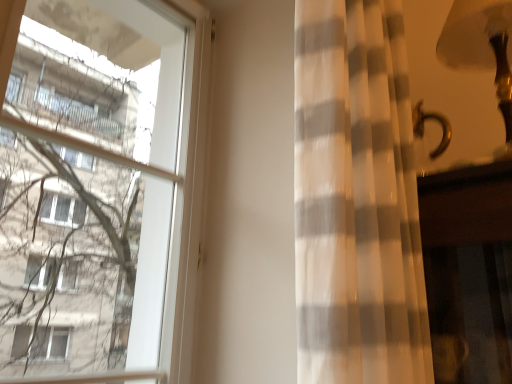
What is the approximate width of white sheer curtain at right?

13.46 inches.

This screenshot has height=384, width=512. Describe the element at coordinates (356, 199) in the screenshot. I see `white sheer curtain at right` at that location.

In order to click on white sheer curtain at right in this screenshot , I will do click(356, 199).

Image resolution: width=512 pixels, height=384 pixels. In order to click on window that is behind the white sheer curtain at right in this screenshot , I will do `click(97, 188)`.

Considering the relative positions of transparent glass window at left and white sheer curtain at right in the image provided, is transparent glass window at left to the right of white sheer curtain at right from the viewer's perspective?

No.

Between transparent glass window at left and white sheer curtain at right, which one has smaller width?

With smaller width is transparent glass window at left.

Considering the sizes of objects white sheer curtain at right and gold metallic table lamp at upper right in the image provided, who is bigger, white sheer curtain at right or gold metallic table lamp at upper right?

white sheer curtain at right is bigger.

Is white sheer curtain at right closer to camera compared to gold metallic table lamp at upper right?

Yes, white sheer curtain at right is in front of gold metallic table lamp at upper right.

From the image's perspective, relative to gold metallic table lamp at upper right, is white sheer curtain at right above or below?

From the image's perspective, white sheer curtain at right appears below gold metallic table lamp at upper right.

Is gold metallic table lamp at upper right oriented towards white sheer curtain at right?

Yes.

Between gold metallic table lamp at upper right and white sheer curtain at right, which one appears on the left side from the viewer's perspective?

Positioned to the left is white sheer curtain at right.

Based on the photo, from a real-world perspective, between gold metallic table lamp at upper right and white sheer curtain at right, who is vertically higher?

gold metallic table lamp at upper right.

Would you say white sheer curtain at right is a long distance from transparent glass window at left?

white sheer curtain at right is actually quite close to transparent glass window at left.

Is transparent glass window at left at the back of white sheer curtain at right?

Yes, white sheer curtain at right is positioned with its back facing transparent glass window at left.

Is white sheer curtain at right located outside transparent glass window at left?

Yes, white sheer curtain at right is not within transparent glass window at left.

Identify the location of curtain above the transparent glass window at left (from a real-world perspective). (356, 199).

Is transparent glass window at left facing towards gold metallic table lamp at upper right?

No, transparent glass window at left is not aimed at gold metallic table lamp at upper right.

Is transparent glass window at left far away from gold metallic table lamp at upper right?

Indeed, transparent glass window at left is not near gold metallic table lamp at upper right.

Is point (124, 57) positioned before point (448, 29)?

No, it is behind (448, 29).

Considering the points (496, 0) and (75, 242), which point is behind, point (496, 0) or point (75, 242)?

The point (75, 242) is more distant.

Would you consider gold metallic table lamp at upper right to be distant from transparent glass window at left?

gold metallic table lamp at upper right is far away from transparent glass window at left.

From a real-world perspective, is gold metallic table lamp at upper right positioned above or below transparent glass window at left?

gold metallic table lamp at upper right is above transparent glass window at left.

You are a GUI agent. You are given a task and a screenshot of the screen. Output one action in this format:
    pyautogui.click(x=<x>, y=<y>)
    Task: Click on the curtain lying above the transparent glass window at left (from the image's perspective)
    
    Given the screenshot: What is the action you would take?
    pyautogui.click(x=356, y=199)

Identify the location of table lamp behind the white sheer curtain at right. (482, 49).

Based on their spatial positions, is gold metallic table lamp at upper right or transparent glass window at left closer to white sheer curtain at right?

Among the two, gold metallic table lamp at upper right is located nearer to white sheer curtain at right.

Estimate the real-world distances between objects in this image. Which object is further from gold metallic table lamp at upper right, white sheer curtain at right or transparent glass window at left?

transparent glass window at left is further to gold metallic table lamp at upper right.

Which object lies nearer to the anchor point white sheer curtain at right, transparent glass window at left or gold metallic table lamp at upper right?

gold metallic table lamp at upper right lies closer to white sheer curtain at right than the other object.

From the image, which object appears to be farther from transparent glass window at left, gold metallic table lamp at upper right or white sheer curtain at right?

gold metallic table lamp at upper right is further to transparent glass window at left.

From the image, which object appears to be nearer to gold metallic table lamp at upper right, transparent glass window at left or white sheer curtain at right?

white sheer curtain at right is closer to gold metallic table lamp at upper right.

Estimate the real-world distances between objects in this image. Which object is further from transparent glass window at left, white sheer curtain at right or gold metallic table lamp at upper right?

gold metallic table lamp at upper right is positioned further to the anchor transparent glass window at left.

Where is `curtain between transparent glass window at left and gold metallic table lamp at upper right`? curtain between transparent glass window at left and gold metallic table lamp at upper right is located at coordinates (356, 199).